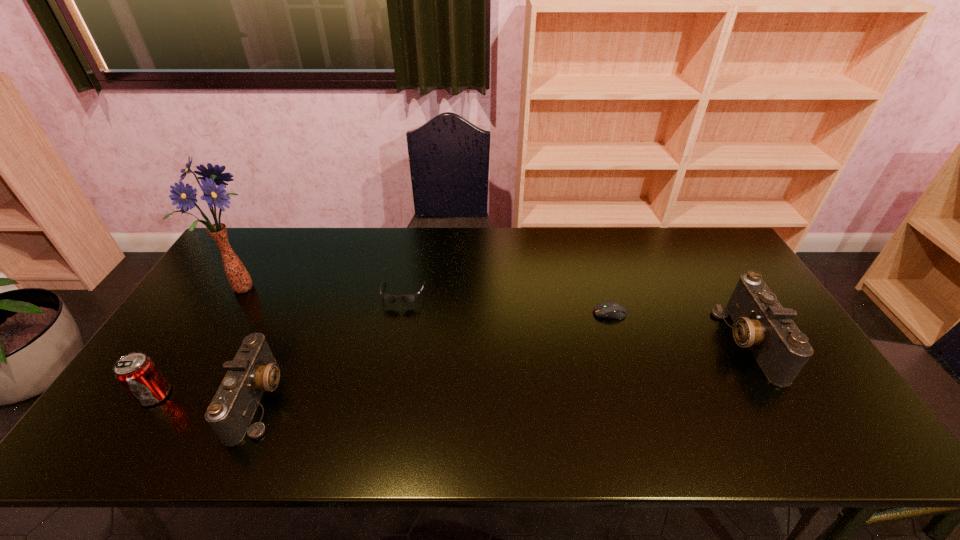
I want to click on location for an additional camera to make spacing equal, so click(517, 369).